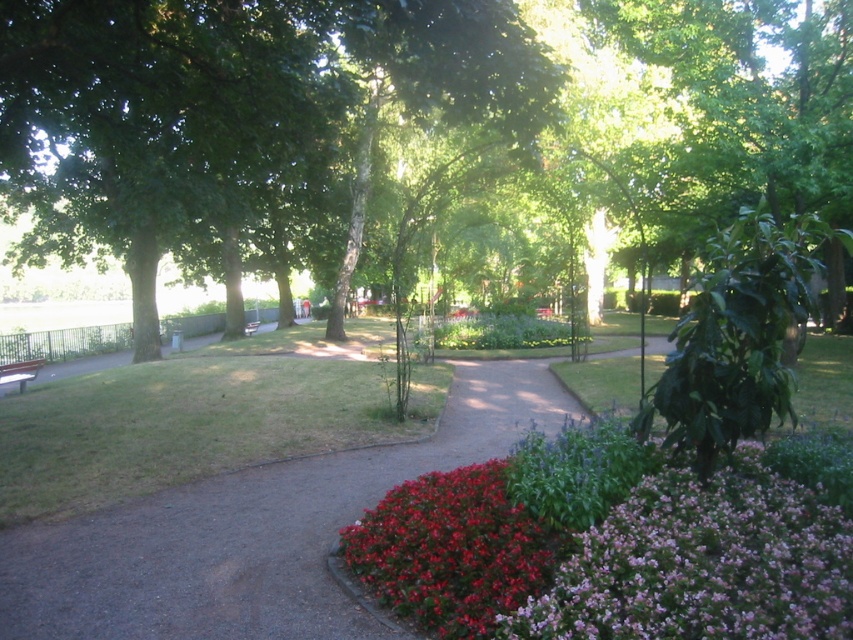
Identify the location of green leafy tree at center. (409, 131).

The width and height of the screenshot is (853, 640). What are the coordinates of `green leafy tree at center` in the screenshot? It's located at (409, 131).

Is point (218, 593) more distant than point (524, 632)?

Yes, point (218, 593) is farther from viewer.

Where is `dirt path at center`? dirt path at center is located at coordinates (251, 532).

Which is behind, point (445, 579) or point (39, 362)?

Point (39, 362)

Consider the image. Measure the distance between vivid red petals at center and camera.

The distance of vivid red petals at center from camera is 4.00 meters.

You are a GUI agent. You are given a task and a screenshot of the screen. Output one action in this format:
    pyautogui.click(x=<x>, y=<y>)
    Task: Click on the vivid red petals at center
    This screenshot has width=853, height=640.
    Given the screenshot: What is the action you would take?
    pyautogui.click(x=451, y=550)